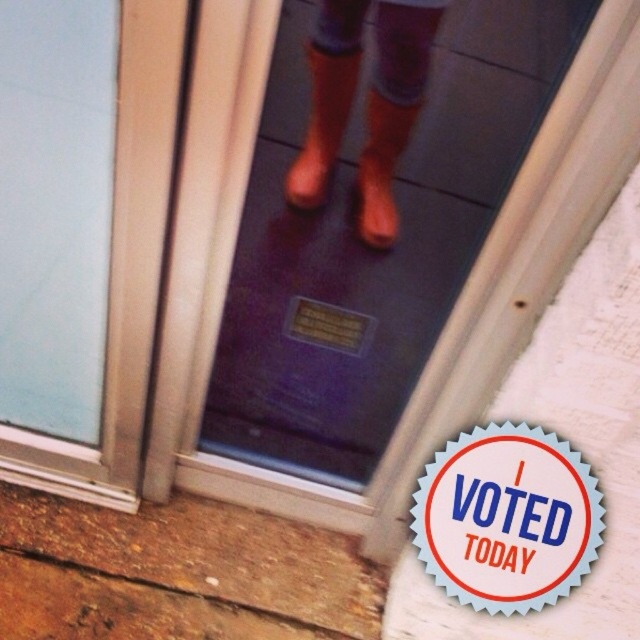
Between orange rubber boots at center and orange rubber boot at center, which one has more height?

With more height is orange rubber boots at center.

Between orange rubber boots at center and orange rubber boot at center, which one appears on the right side from the viewer's perspective?

orange rubber boot at center is more to the right.

Does point (397, 49) come in front of point (369, 189)?

Yes, it is.

The height and width of the screenshot is (640, 640). What are the coordinates of `orange rubber boots at center` in the screenshot? It's located at (392, 108).

Can you confirm if blue paper sticker at center is shorter than brown leather boot at center?

No, blue paper sticker at center is not shorter than brown leather boot at center.

Is blue paper sticker at center wider than brown leather boot at center?

Yes, blue paper sticker at center is wider than brown leather boot at center.

The width and height of the screenshot is (640, 640). Find the location of `blue paper sticker at center`. blue paper sticker at center is located at coordinates (508, 516).

Which is more to the right, brown leather boot at center or orange rubber boot at center?

orange rubber boot at center is more to the right.

Image resolution: width=640 pixels, height=640 pixels. Describe the element at coordinates (323, 124) in the screenshot. I see `brown leather boot at center` at that location.

Where is `brown leather boot at center`? This screenshot has height=640, width=640. brown leather boot at center is located at coordinates (323, 124).